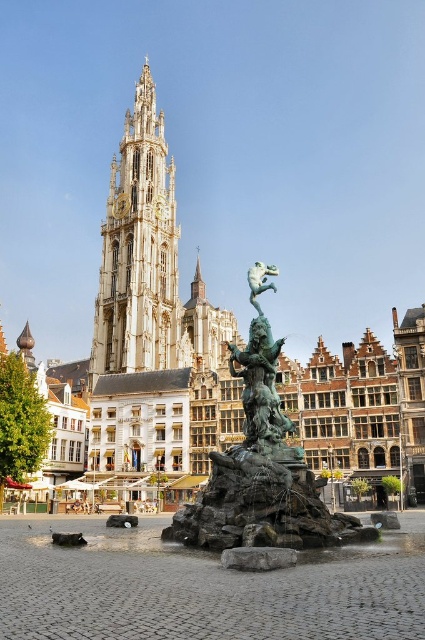
Between point (292, 545) and point (161, 288), which one is positioned behind?

The point (161, 288) is behind.

Is bronze statue at center thinner than white stone tower at center?

Correct, bronze statue at center's width is less than white stone tower at center's.

Consider the image. Who is more forward, (331, 528) or (124, 200)?

Point (331, 528)

In order to click on bronze statue at center in this screenshot , I will do `click(261, 467)`.